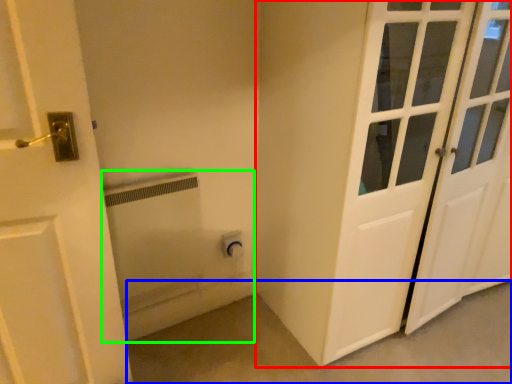
Question: Estimate the real-world distances between objects in this image. Which object is closer to door (highlighted by a red box), concrete (highlighted by a blue box) or bath (highlighted by a green box)?

Choices:
 (A) concrete
 (B) bath

Answer: (A)